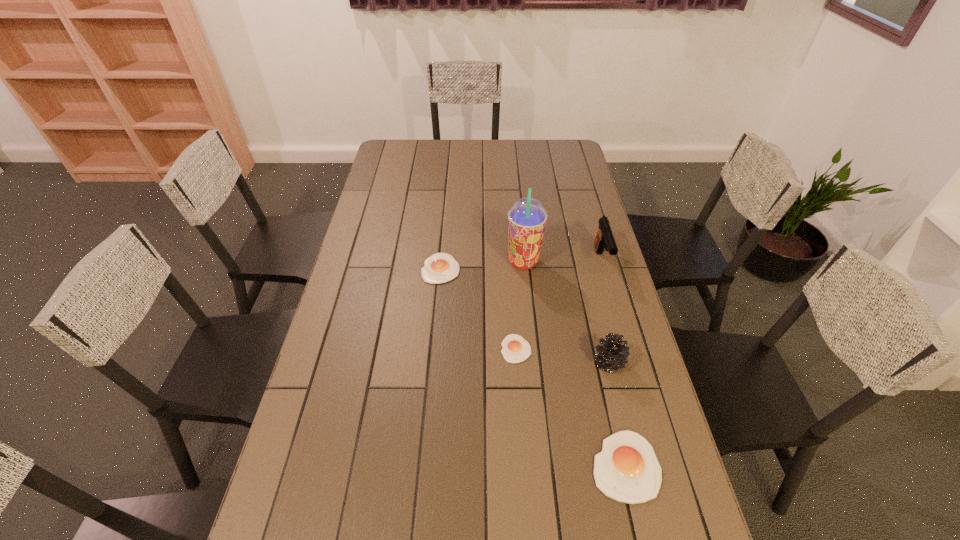
The image size is (960, 540). Find the location of `the farthest egg yolk`. the farthest egg yolk is located at coordinates (439, 268).

I want to click on the leftmost object, so click(439, 268).

This screenshot has width=960, height=540. Find the location of `the second nearest egg yolk`. the second nearest egg yolk is located at coordinates [516, 349].

This screenshot has height=540, width=960. I want to click on the shortest object, so click(x=516, y=349).

Locate an element on the screen. the nearest egg yolk is located at coordinates (627, 470).

Where is `the nearest object`? The width and height of the screenshot is (960, 540). the nearest object is located at coordinates (627, 470).

Identify the location of smoothie. (527, 217).

Where is `pinecone`? Image resolution: width=960 pixels, height=540 pixels. pinecone is located at coordinates (613, 353).

Locate an element on the screen. Image resolution: width=960 pixels, height=540 pixels. the fifth shortest object is located at coordinates (604, 238).

Where is `free space located 0.120m on the front of the leftmost object`? free space located 0.120m on the front of the leftmost object is located at coordinates (437, 313).